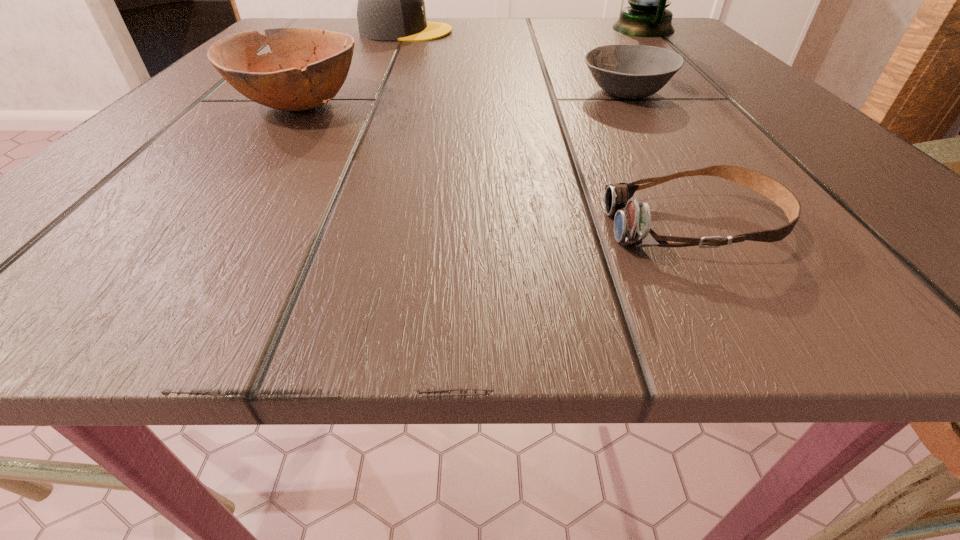
Locate an element on the screen. bowl located at the right edge is located at coordinates (626, 71).

The image size is (960, 540). I want to click on goggles present at the right edge, so tap(632, 221).

Locate an element on the screen. The width and height of the screenshot is (960, 540). object that is at the far left corner is located at coordinates (391, 6).

Locate an element on the screen. The image size is (960, 540). object situated at the far right corner is located at coordinates (646, 16).

Identify the location of object present at the near right corner. (632, 221).

Where is `vacant position at the far edge of the desktop`? The image size is (960, 540). vacant position at the far edge of the desktop is located at coordinates (519, 18).

Locate an element on the screen. free space at the near edge of the desktop is located at coordinates (600, 262).

This screenshot has width=960, height=540. In the image, there is a desktop. What are the coordinates of `vacant area at the left edge` in the screenshot? It's located at (96, 207).

The width and height of the screenshot is (960, 540). What are the coordinates of `vacant area at the right edge of the desktop` in the screenshot? It's located at (684, 72).

Image resolution: width=960 pixels, height=540 pixels. I want to click on vacant position at the far left corner of the desktop, so click(x=327, y=23).